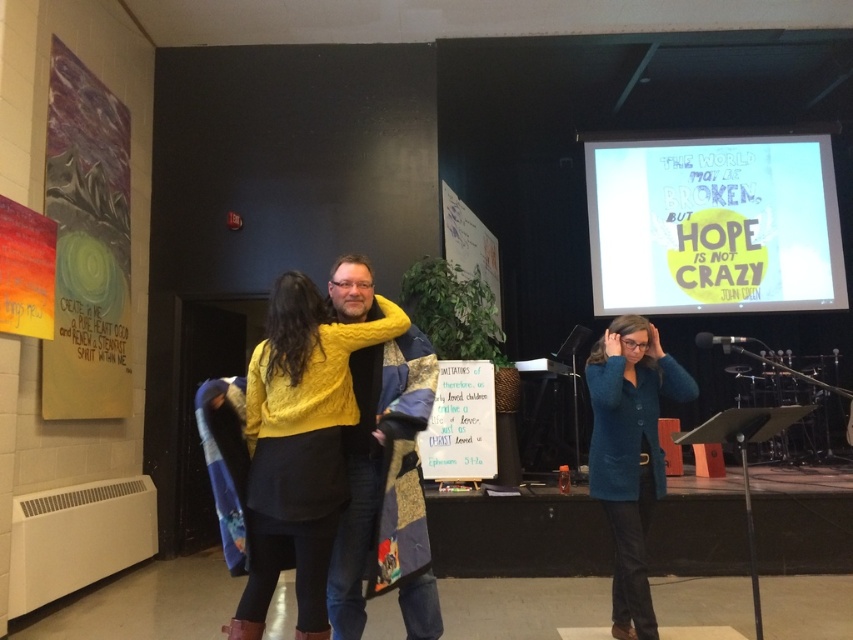
Measure the distance between knitted yellow scarf at center and teal matte blazer at center.

They are 1.02 meters apart.

Consider the image. Which of these two, knitted yellow scarf at center or teal matte blazer at center, stands shorter?

With less height is knitted yellow scarf at center.

Locate an element on the screen. Image resolution: width=853 pixels, height=640 pixels. knitted yellow scarf at center is located at coordinates (373, 461).

Find the location of a particular element. knitted yellow scarf at center is located at coordinates (373, 461).

Who is more distant from viewer, [822,257] or [263,468]?

Point [822,257]

This screenshot has height=640, width=853. What do you see at coordinates (712, 225) in the screenshot?
I see `white glossy projection screen at upper right` at bounding box center [712, 225].

At what (x,y) coordinates should I click in order to perform the action: click on white glossy projection screen at upper right. Please return your answer as a coordinate pair (x, y). Looking at the image, I should click on (712, 225).

Based on the photo, can you confirm if white glossy projection screen at upper right is positioned to the left of teal matte blazer at center?

No, white glossy projection screen at upper right is not to the left of teal matte blazer at center.

Describe the element at coordinates (712, 225) in the screenshot. The image size is (853, 640). I see `white glossy projection screen at upper right` at that location.

The height and width of the screenshot is (640, 853). Find the location of `white glossy projection screen at upper right`. white glossy projection screen at upper right is located at coordinates (712, 225).

You are a GUI agent. You are given a task and a screenshot of the screen. Output one action in this format:
    pyautogui.click(x=<x>, y=<y>)
    Task: Click on the white glossy projection screen at upper right
    This screenshot has height=640, width=853.
    Given the screenshot: What is the action you would take?
    pos(712,225)